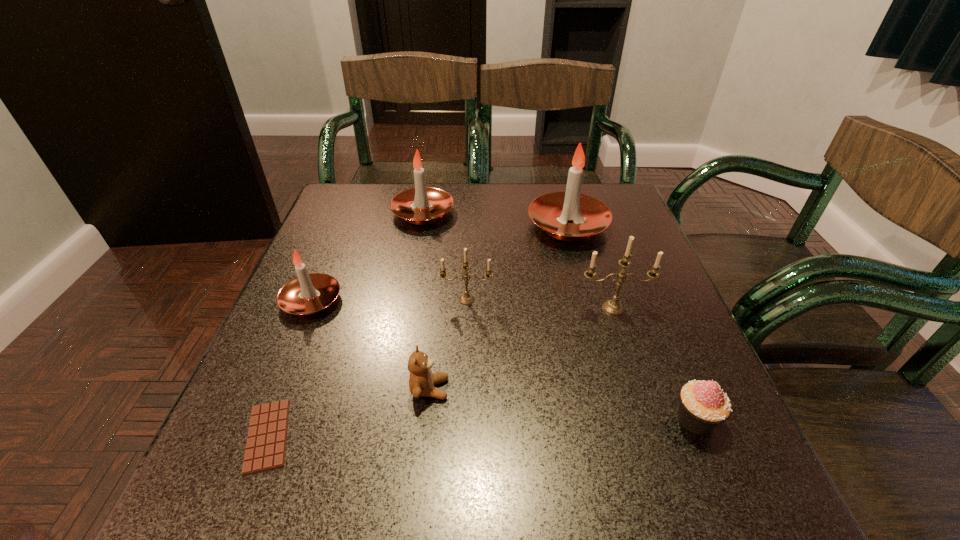
I want to click on candle located at the left edge, so click(x=308, y=294).

Identify the location of candy bar situated at the left edge. This screenshot has height=540, width=960. (266, 443).

Identify the location of cupcake at the right edge. The height and width of the screenshot is (540, 960). (703, 405).

Identify the location of object that is at the near left corner. (266, 443).

I want to click on object located at the far right corner, so click(553, 212).

Image resolution: width=960 pixels, height=540 pixels. What are the coordinates of `vacant space at the far edge of the desktop` in the screenshot? It's located at (531, 183).

At what (x,y) coordinates should I click in order to perform the action: click on free region at the near edge. Please return your answer as a coordinate pair (x, y). This screenshot has height=540, width=960. Looking at the image, I should click on (474, 467).

The width and height of the screenshot is (960, 540). In the image, there is a desktop. Find the location of `vacant space at the left edge`. vacant space at the left edge is located at coordinates (284, 357).

In the image, there is a desktop. Where is `free region at the right edge`? The height and width of the screenshot is (540, 960). free region at the right edge is located at coordinates (668, 395).

Where is `free area in between the second biggest white candle and the bigger metallic candle`? The width and height of the screenshot is (960, 540). free area in between the second biggest white candle and the bigger metallic candle is located at coordinates (518, 260).